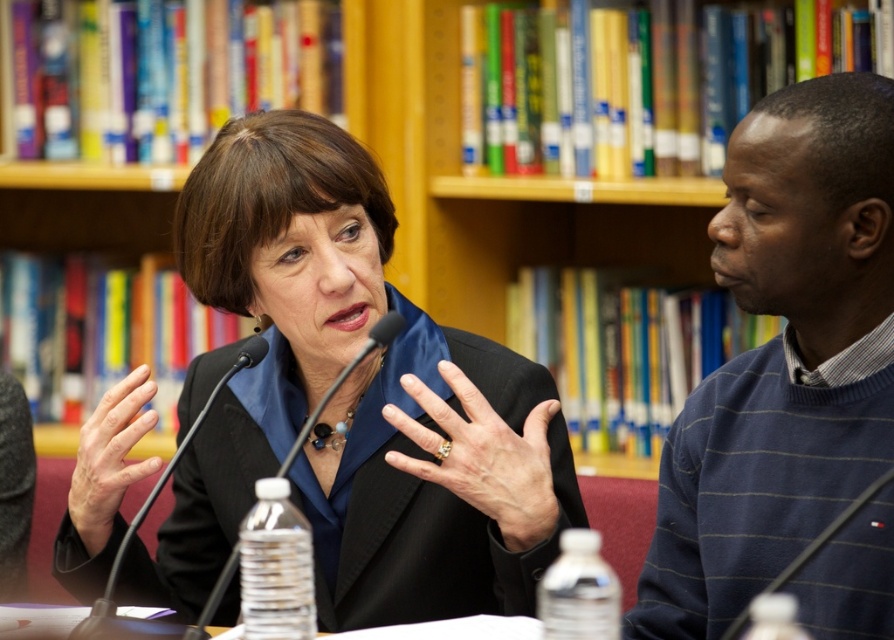
How distant is black matte microphone at center from black plastic microphone at center?

3.93 inches

Image resolution: width=894 pixels, height=640 pixels. Find the location of `black matte microphone at center`. black matte microphone at center is located at coordinates pyautogui.click(x=139, y=525).

At what (x,y) coordinates should I click in order to perform the action: click on black matte microphone at center. Please return your answer as a coordinate pair (x, y). The width and height of the screenshot is (894, 640). Looking at the image, I should click on (139, 525).

Who is higher up, black matte suit at center or blue striped sweater at right?

blue striped sweater at right is higher up.

Does point (243, 173) come in front of point (786, 257)?

No, it is behind (786, 257).

Who is more forward, (277, 129) or (876, 428)?

Point (876, 428) is more forward.

This screenshot has width=894, height=640. In order to click on black matte suit at center in this screenshot , I will do `click(353, 403)`.

Does point (218, 614) come in front of point (370, 336)?

No, (218, 614) is behind (370, 336).

Which is more to the left, black matte suit at center or black plastic microphone at center?

From the viewer's perspective, black plastic microphone at center appears more on the left side.

Is point (327, 308) positioned before point (192, 634)?

No, (327, 308) is further to viewer.

Locate an element on the screen. This screenshot has height=640, width=894. black matte suit at center is located at coordinates (353, 403).